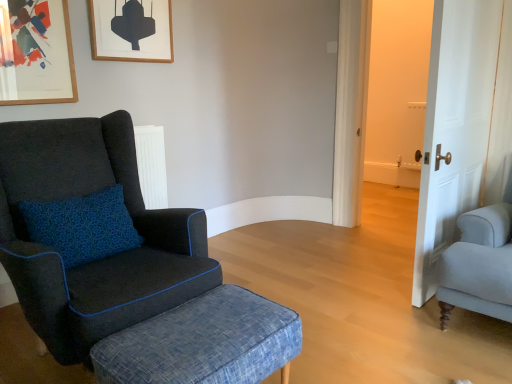
Question: Would you say white wood door at right is outside wooden picture frame at upper left, which appears as the 1th picture frame when viewed from the left?

Choices:
 (A) no
 (B) yes

Answer: (B)

Question: Is white wood door at right at the left side of wooden picture frame at upper left, the 2th picture frame in the right-to-left sequence?

Choices:
 (A) yes
 (B) no

Answer: (B)

Question: Is white wood door at right taller than wooden picture frame at upper left, which appears as the 1th picture frame when viewed from the left?

Choices:
 (A) no
 (B) yes

Answer: (B)

Question: Is white wood door at right closer to the viewer compared to wooden picture frame at upper left, the first picture frame positioned from the front?

Choices:
 (A) yes
 (B) no

Answer: (A)

Question: Would you say wooden picture frame at upper left, which appears as the 1th picture frame when viewed from the left, is part of white wood door at right's contents?

Choices:
 (A) no
 (B) yes

Answer: (A)

Question: Is wooden picture frame at upper left, which appears as the 1th picture frame when viewed from the left, bigger or smaller than velvet dark blue armchair at left?

Choices:
 (A) small
 (B) big

Answer: (A)

Question: Would you say wooden picture frame at upper left, which appears as the 1th picture frame when viewed from the left, is inside or outside velvet dark blue armchair at left?

Choices:
 (A) outside
 (B) inside

Answer: (A)

Question: In terms of height, does wooden picture frame at upper left, which appears as the 1th picture frame when viewed from the left, look taller or shorter compared to velvet dark blue armchair at left?

Choices:
 (A) tall
 (B) short

Answer: (B)

Question: From a real-world perspective, relative to velvet dark blue armchair at left, is wooden picture frame at upper left, the 2th picture frame positioned from the back, vertically above or below?

Choices:
 (A) above
 (B) below

Answer: (A)

Question: In the image, is denim textured stool at lower left positioned in front of or behind white wood door at right?

Choices:
 (A) behind
 (B) front

Answer: (B)

Question: Considering the positions of denim textured stool at lower left and white wood door at right in the image, is denim textured stool at lower left taller or shorter than white wood door at right?

Choices:
 (A) tall
 (B) short

Answer: (B)

Question: From the image's perspective, relative to white wood door at right, is denim textured stool at lower left above or below?

Choices:
 (A) below
 (B) above

Answer: (A)

Question: Is denim textured stool at lower left bigger or smaller than white wood door at right?

Choices:
 (A) small
 (B) big

Answer: (A)

Question: From their relative heights in the image, would you say wooden picture frame at upper center, positioned as the 2th picture frame in left-to-right order, is taller or shorter than denim textured stool at lower left?

Choices:
 (A) tall
 (B) short

Answer: (A)

Question: From the image's perspective, is wooden picture frame at upper center, marked as the 1th picture frame in a back-to-front arrangement, positioned above or below denim textured stool at lower left?

Choices:
 (A) below
 (B) above

Answer: (B)